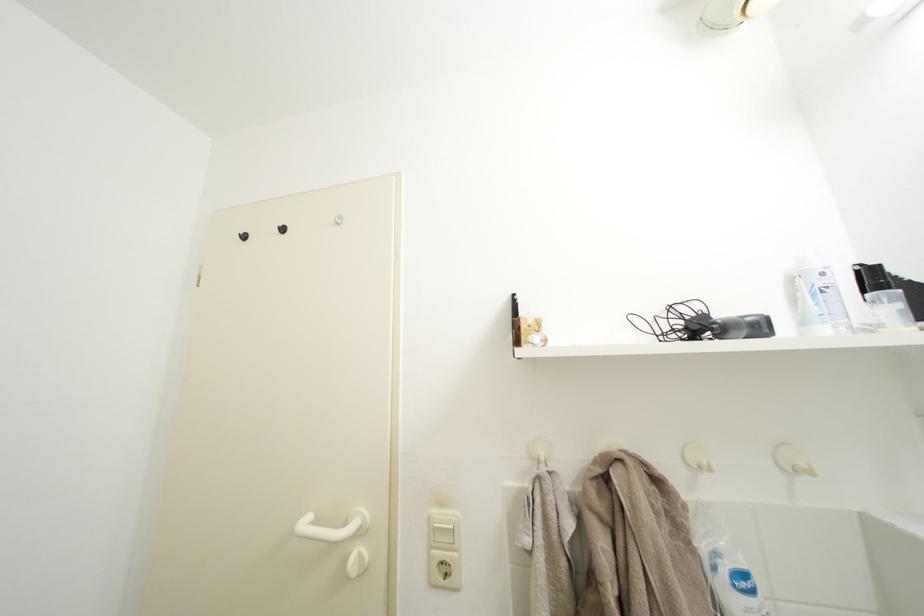
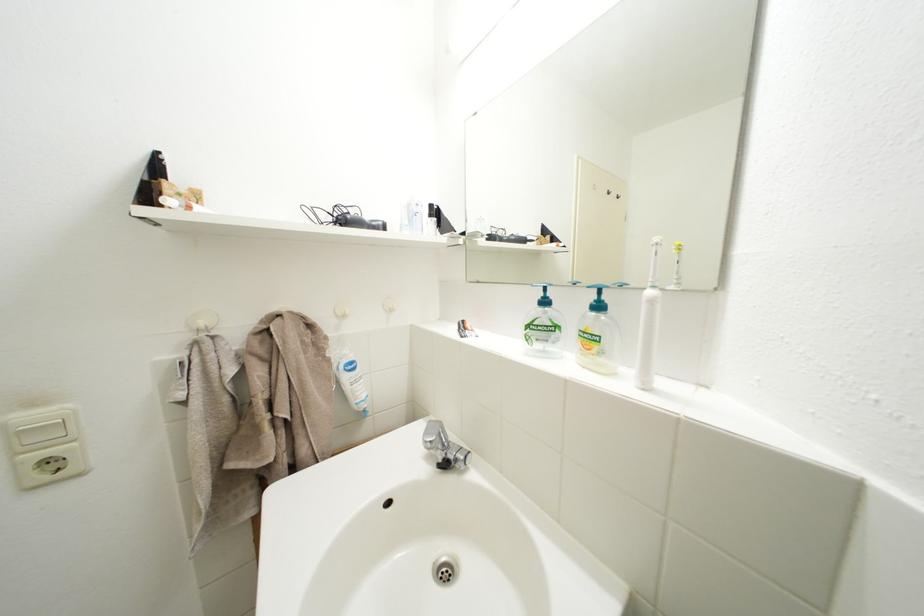
Where in the second image is the point corresponding to point (758, 326) from the first image?

(383, 228)